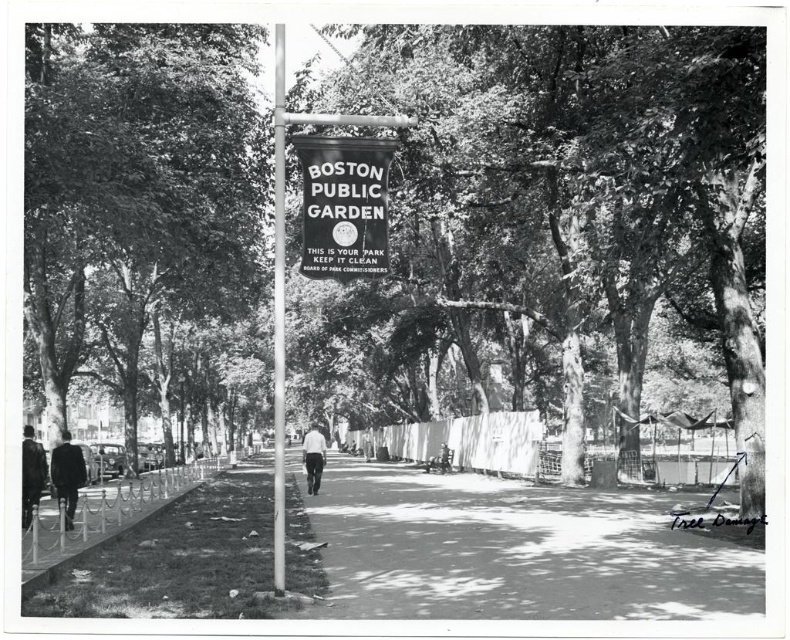
You are standing at the entrance of the Boston Public Garden and see the smooth bark tree at center. If you walk straight ahead, will you move closer to the tree or further away from it?

The smooth bark tree at center is located at point (600,186), so if you walk straight ahead from the entrance, you will move closer to the tree since it is positioned along the central pathway leading into the park.